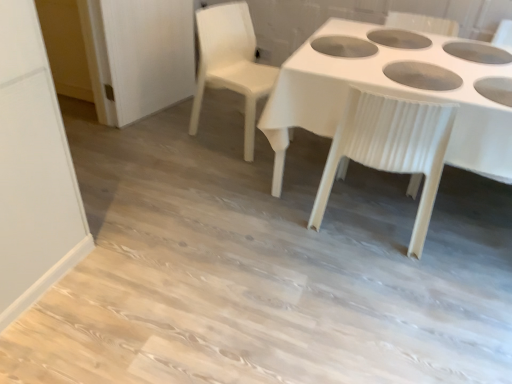
I want to click on vacant area that lies between white plastic table at center and white plastic chair at upper center, the first chair from the left, so click(x=233, y=165).